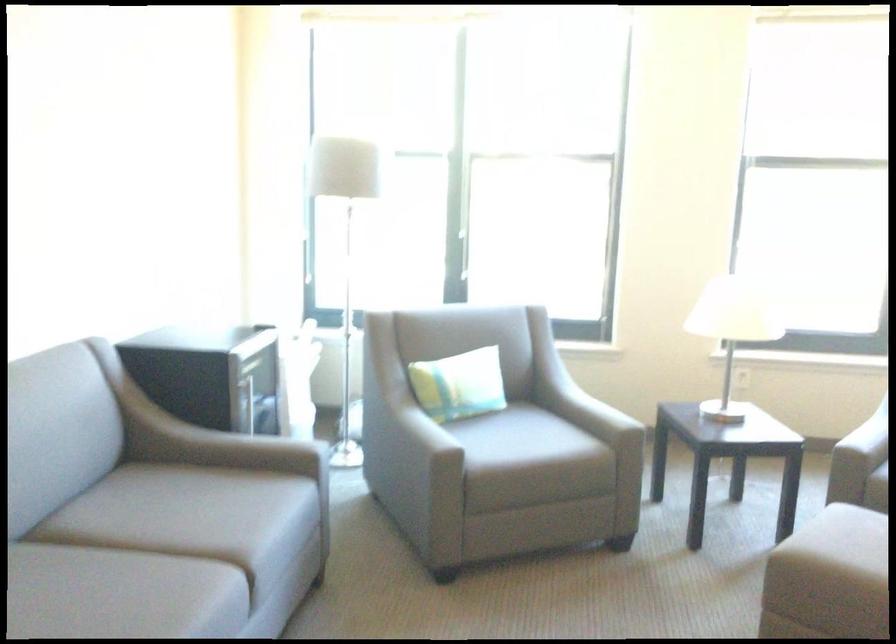
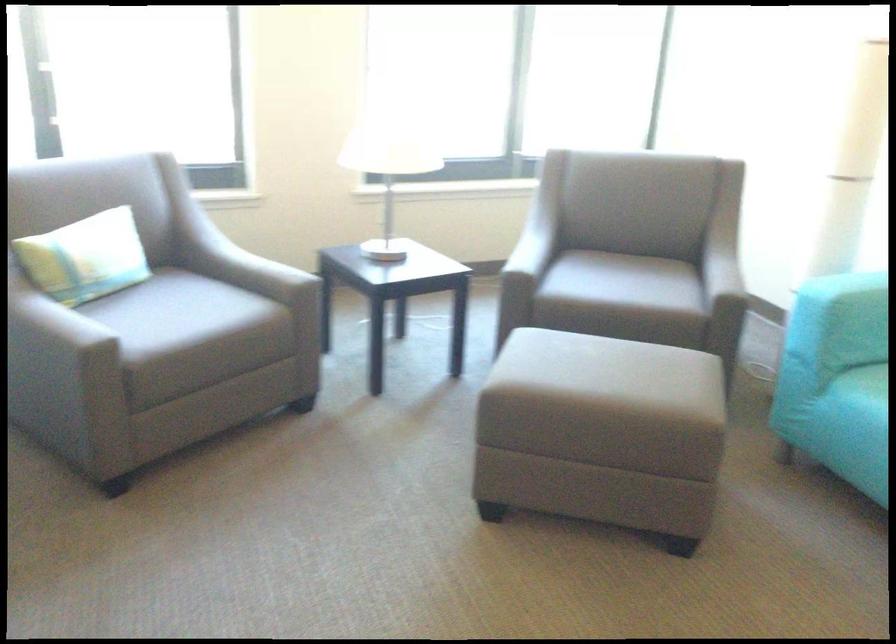
Question: In a continuous first-person perspective shot, in which direction is the camera moving?

Choices:
 (A) Left
 (B) Right
 (C) Forward
 (D) Backward

Answer: (C)